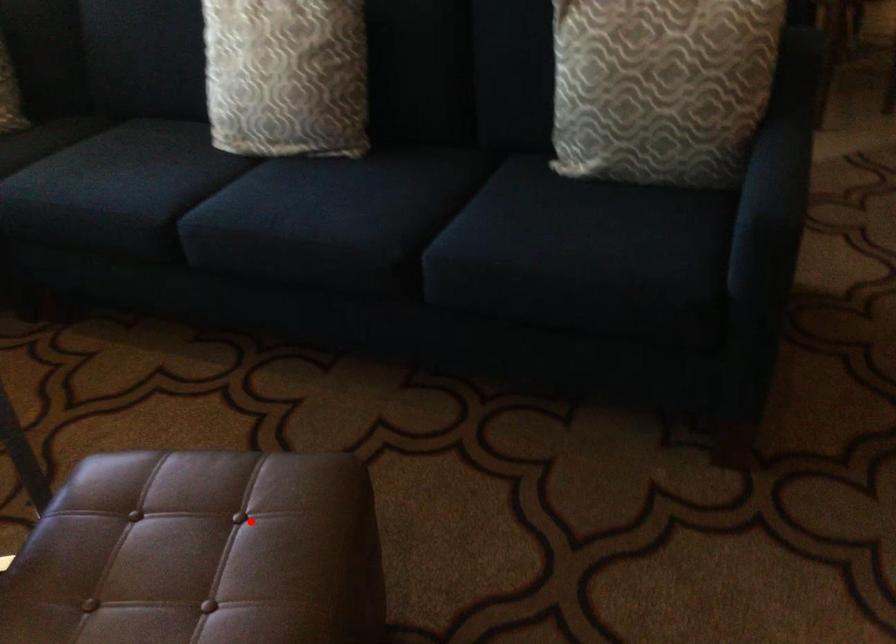
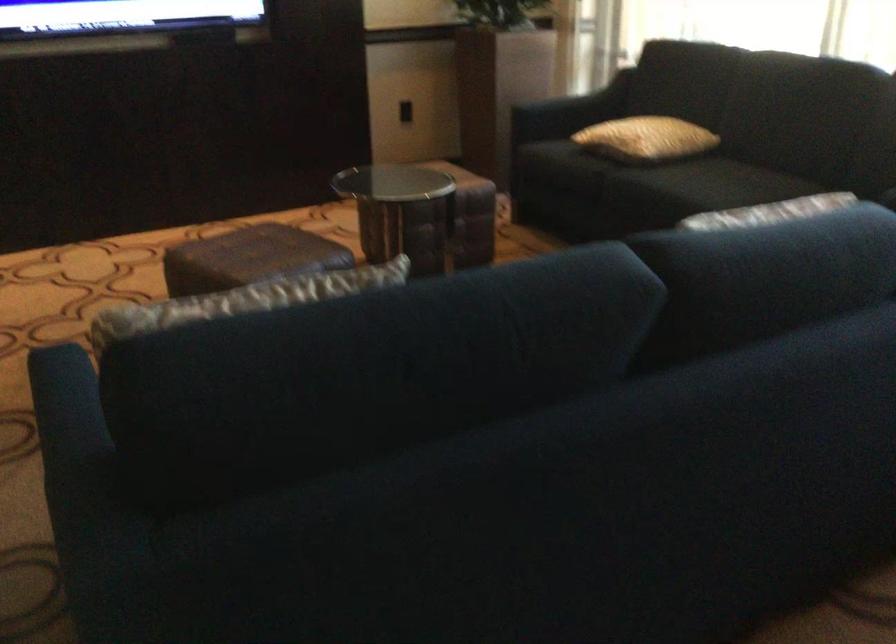
Find the pixel in the second image that matches the highlighted location in the first image.

(248, 258)